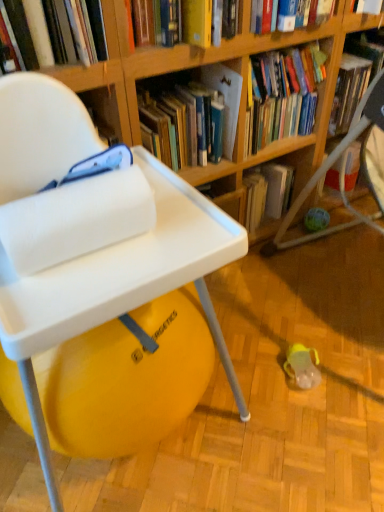
Question: Considering the relative sizes of wooden bookshelf at upper center, positioned as the 2th shelf in back-to-front order, and wooden bookshelf at center, the 1th shelf viewed from the back, in the image provided, is wooden bookshelf at upper center, positioned as the 2th shelf in back-to-front order, bigger than wooden bookshelf at center, the 1th shelf viewed from the back,?

Choices:
 (A) no
 (B) yes

Answer: (B)

Question: Can you confirm if wooden bookshelf at upper center, the 2th shelf when ordered from right to left, is thinner than wooden bookshelf at center, placed as the 2th shelf when sorted from left to right?

Choices:
 (A) no
 (B) yes

Answer: (B)

Question: Considering the relative sizes of wooden bookshelf at upper center, the 2th shelf when ordered from right to left, and wooden bookshelf at center, placed as the 2th shelf when sorted from left to right, in the image provided, is wooden bookshelf at upper center, the 2th shelf when ordered from right to left, shorter than wooden bookshelf at center, placed as the 2th shelf when sorted from left to right,?

Choices:
 (A) yes
 (B) no

Answer: (B)

Question: From the image's perspective, does wooden bookshelf at upper center, the first shelf viewed from the left, appear higher than wooden bookshelf at center, the 1th shelf viewed from the back?

Choices:
 (A) no
 (B) yes

Answer: (B)

Question: Is wooden bookshelf at center, which appears as the second shelf when viewed from the front, at the back of wooden bookshelf at upper center, the 2th shelf when ordered from right to left?

Choices:
 (A) no
 (B) yes

Answer: (A)

Question: Looking at their shapes, would you say white plastic chair at left is wider or thinner than hardcover book at upper center, arranged as the first book when viewed from the right?

Choices:
 (A) thin
 (B) wide

Answer: (B)

Question: Considering their positions, is white plastic chair at left located in front of or behind hardcover book at upper center, arranged as the first book when viewed from the right?

Choices:
 (A) behind
 (B) front

Answer: (B)

Question: In terms of height, does white plastic chair at left look taller or shorter compared to hardcover book at upper center, arranged as the first book when viewed from the right?

Choices:
 (A) short
 (B) tall

Answer: (B)

Question: From a real-world perspective, relative to hardcover book at upper center, arranged as the third book when viewed from the left, is white plastic chair at left vertically above or below?

Choices:
 (A) above
 (B) below

Answer: (B)

Question: Is hardcover book at upper left, which is counted as the first book, starting from the left, situated inside white plastic chair at left or outside?

Choices:
 (A) inside
 (B) outside

Answer: (B)

Question: Looking at the image, does hardcover book at upper left, which appears as the 3th book when viewed from the right, seem bigger or smaller compared to white plastic chair at left?

Choices:
 (A) small
 (B) big

Answer: (A)

Question: From their relative heights in the image, would you say hardcover book at upper left, which is counted as the first book, starting from the left, is taller or shorter than white plastic chair at left?

Choices:
 (A) short
 (B) tall

Answer: (A)

Question: From a real-world perspective, is hardcover book at upper left, which appears as the 3th book when viewed from the right, physically located above or below white plastic chair at left?

Choices:
 (A) below
 (B) above

Answer: (B)

Question: Considering the positions of point (23, 25) and point (292, 199), is point (23, 25) closer or farther from the camera than point (292, 199)?

Choices:
 (A) farther
 (B) closer

Answer: (B)

Question: In the image, is hardcover book at upper left, which appears as the 3th book when viewed from the right, positioned in front of or behind wooden bookshelf at center, placed as the 2th shelf when sorted from left to right?

Choices:
 (A) front
 (B) behind

Answer: (A)